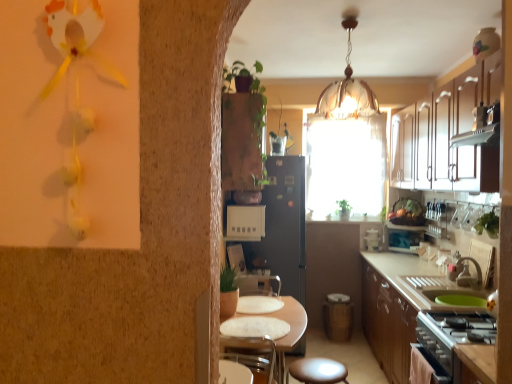
The height and width of the screenshot is (384, 512). Find the location of `free point above stainless steel stove at lower right (from a real-world perspective)`. free point above stainless steel stove at lower right (from a real-world perspective) is located at coordinates (475, 320).